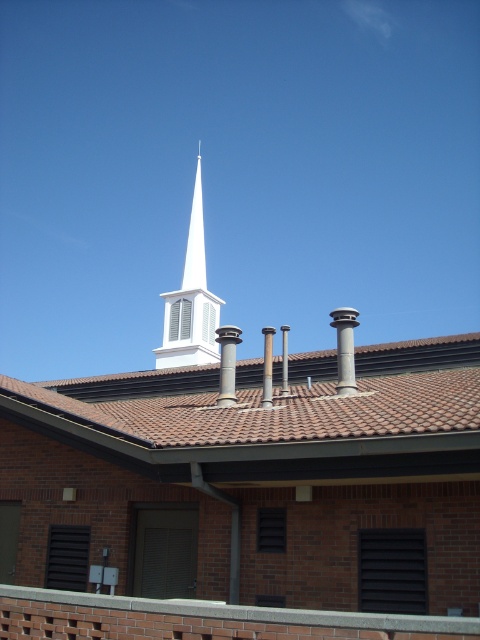
Consider the image. Is slate gray chimney at upper center bigger than slate gray stone chimney at center?

Correct, slate gray chimney at upper center is larger in size than slate gray stone chimney at center.

Is the position of slate gray chimney at upper center less distant than that of slate gray stone chimney at center?

Yes, slate gray chimney at upper center is closer to the viewer.

Identify the location of slate gray chimney at upper center. The image size is (480, 640). (345, 348).

Locate an element on the screen. This screenshot has height=640, width=480. slate gray chimney at upper center is located at coordinates (345, 348).

Does white smooth steeple at upper center have a lesser width compared to slate gray chimney at upper center?

In fact, white smooth steeple at upper center might be wider than slate gray chimney at upper center.

Does white smooth steeple at upper center have a greater height compared to slate gray chimney at upper center?

Indeed, white smooth steeple at upper center has a greater height compared to slate gray chimney at upper center.

Between point (194, 180) and point (345, 378), which one is positioned behind?

Point (194, 180)

Locate an element on the screen. Image resolution: width=480 pixels, height=640 pixels. white smooth steeple at upper center is located at coordinates (191, 301).

Can you confirm if white smooth steeple at upper center is wider than slate gray stone chimney at center?

Yes.

Which is behind, point (187, 259) or point (269, 374)?

The point (187, 259) is more distant.

Image resolution: width=480 pixels, height=640 pixels. Identify the location of white smooth steeple at upper center. (191, 301).